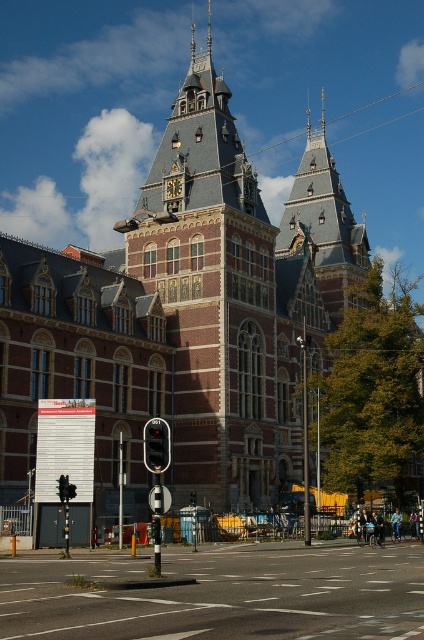
You are a pedestrian standing on the sidewalk in front of the building. You notice the red brick tower at center and the black glass traffic light at center. Which object is positioned higher from the ground?

The red brick tower at center is located above the black glass traffic light at center, so it is positioned higher from the ground.